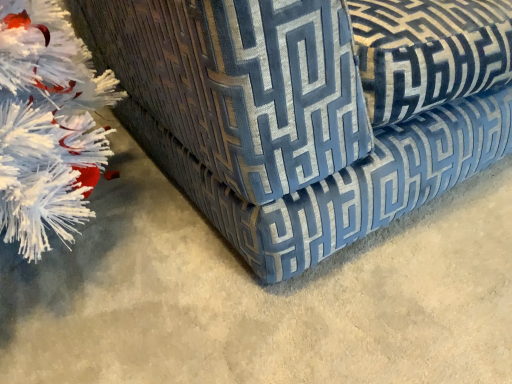
What do you see at coordinates (308, 109) in the screenshot? This screenshot has width=512, height=384. I see `blue velvet ottoman at center` at bounding box center [308, 109].

Identify the location of blue velvet ottoman at center. (308, 109).

Where is `blue velvet ottoman at center`? The width and height of the screenshot is (512, 384). blue velvet ottoman at center is located at coordinates (308, 109).